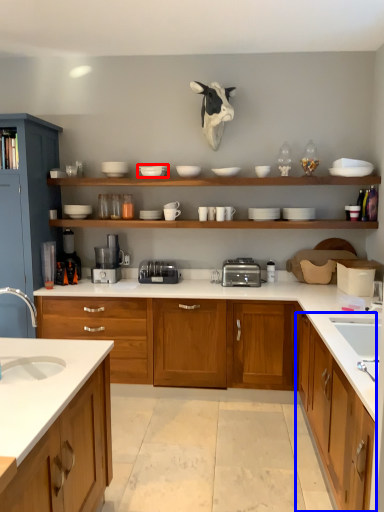
Question: Which object appears closest to the camera in this image, tableware (highlighted by a red box) or cabinetry (highlighted by a blue box)?

Choices:
 (A) tableware
 (B) cabinetry

Answer: (B)